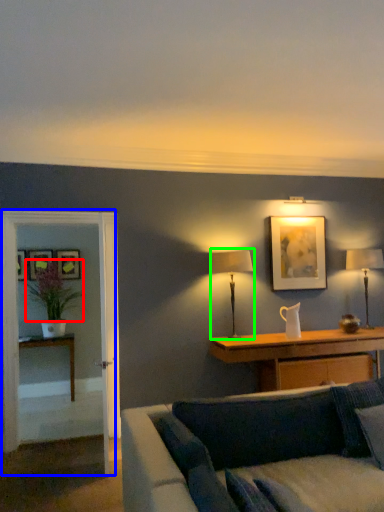
Question: Which is farther away from flower (highlighted by a red box)? glass door (highlighted by a blue box) or table lamp (highlighted by a green box)?

Choices:
 (A) glass door
 (B) table lamp

Answer: (B)